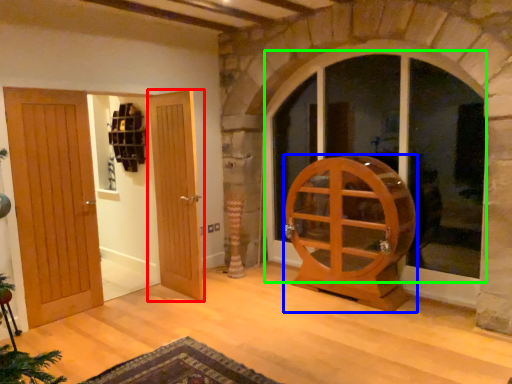
Question: Which is nearer to the door (highlighted by a red box)? furniture (highlighted by a blue box) or window (highlighted by a green box).

Choices:
 (A) furniture
 (B) window

Answer: (A)